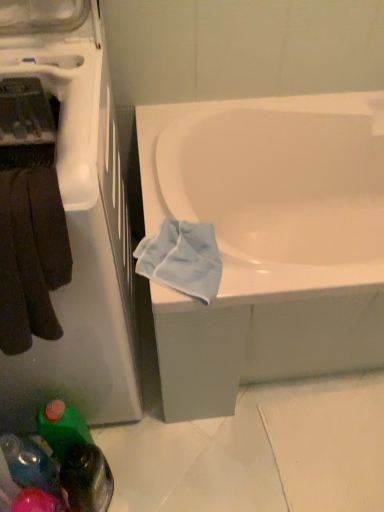
Question: Are translucent plastic bottle at lower left, marked as the 1th bottle in a left-to-right arrangement, and white glossy bathtub at center located far from each other?

Choices:
 (A) yes
 (B) no

Answer: (B)

Question: Is translucent plastic bottle at lower left, marked as the 1th bottle in a left-to-right arrangement, taller than white glossy bathtub at center?

Choices:
 (A) no
 (B) yes

Answer: (A)

Question: From the image's perspective, does translucent plastic bottle at lower left, marked as the 1th bottle in a left-to-right arrangement, appear higher than white glossy bathtub at center?

Choices:
 (A) yes
 (B) no

Answer: (B)

Question: Can you confirm if translucent plastic bottle at lower left, placed as the 2th bottle when sorted from right to left, is thinner than white glossy bathtub at center?

Choices:
 (A) no
 (B) yes

Answer: (B)

Question: Does translucent plastic bottle at lower left, placed as the 2th bottle when sorted from right to left, have a lesser height compared to white glossy bathtub at center?

Choices:
 (A) yes
 (B) no

Answer: (A)

Question: From a real-world perspective, does translucent plastic bottle at lower left, marked as the 1th bottle in a left-to-right arrangement, sit lower than white glossy bathtub at center?

Choices:
 (A) yes
 (B) no

Answer: (A)

Question: Is white glossy dishwasher at left closer to camera compared to light blue fabric at lower right?

Choices:
 (A) yes
 (B) no

Answer: (A)

Question: Is white glossy dishwasher at left outside of light blue fabric at lower right?

Choices:
 (A) yes
 (B) no

Answer: (A)

Question: From a real-world perspective, is white glossy dishwasher at left under light blue fabric at lower right?

Choices:
 (A) no
 (B) yes

Answer: (B)

Question: Considering the relative positions of white glossy dishwasher at left and light blue fabric at lower right in the image provided, is white glossy dishwasher at left to the right of light blue fabric at lower right from the viewer's perspective?

Choices:
 (A) yes
 (B) no

Answer: (B)

Question: From the image's perspective, is white glossy dishwasher at left located above light blue fabric at lower right?

Choices:
 (A) yes
 (B) no

Answer: (A)

Question: Is light blue fabric at lower right located within white glossy dishwasher at left?

Choices:
 (A) no
 (B) yes

Answer: (A)

Question: Is light blue fabric at lower right to the left of green plastic bottle at lower left, which appears as the second bottle when viewed from the left, from the viewer's perspective?

Choices:
 (A) no
 (B) yes

Answer: (A)